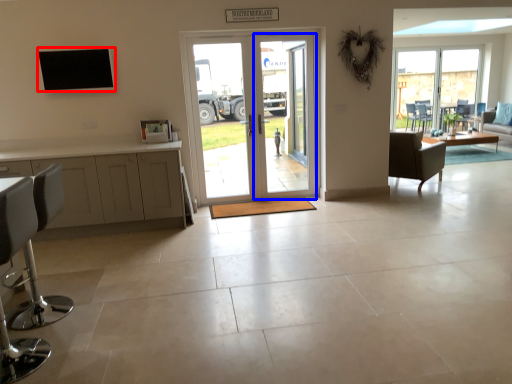
Question: Which point is closer to the camera, window (highlighted by a red box) or screen door (highlighted by a blue box)?

Choices:
 (A) window
 (B) screen door

Answer: (A)